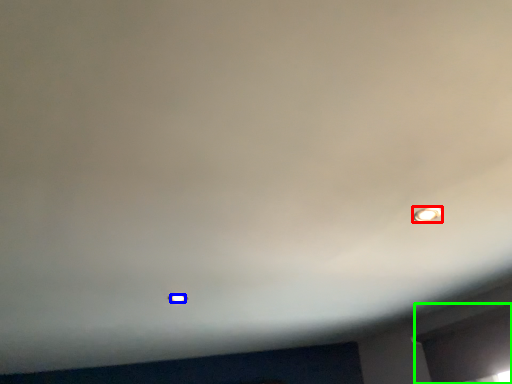
Question: Which is nearer to the light bulb (highlighted by a red box)? light bulb (highlighted by a blue box) or window (highlighted by a green box).

Choices:
 (A) light bulb
 (B) window

Answer: (B)